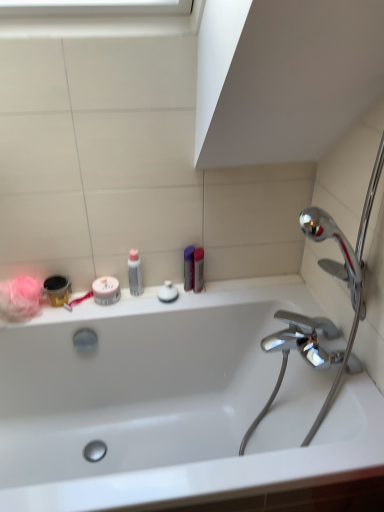
Locate an element on the screen. The width and height of the screenshot is (384, 512). free space in front of translucent plastic bottle at upper center, the 1th toiletry positioned from the left is located at coordinates (130, 309).